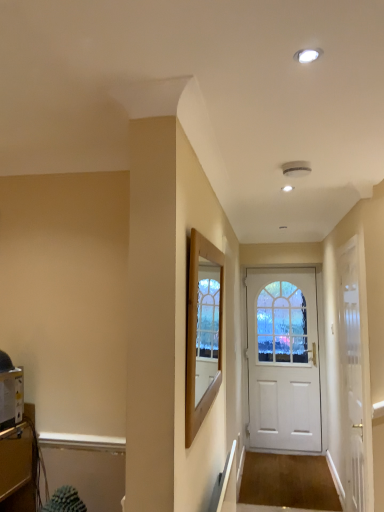
This screenshot has width=384, height=512. What do you see at coordinates (195, 332) in the screenshot? I see `wooden frame at center` at bounding box center [195, 332].

The height and width of the screenshot is (512, 384). I want to click on white glossy door at center, which is the 2th door from back to front, so click(x=352, y=381).

Is metallic silver toaster at lower left looking in the opposite direction of white matte door at center, the second door from the front?

No, metallic silver toaster at lower left is not facing away from white matte door at center, the second door from the front.

Relative to white matte door at center, marked as the first door in a back-to-front arrangement, is metallic silver toaster at lower left in front or behind?

metallic silver toaster at lower left is positioned closer to the viewer than white matte door at center, marked as the first door in a back-to-front arrangement.

From the image's perspective, would you say metallic silver toaster at lower left is shown under white matte door at center, marked as the first door in a back-to-front arrangement?

No.

Is metallic silver toaster at lower left surrounded by wooden frame at center?

No, metallic silver toaster at lower left is located outside of wooden frame at center.

Between wooden frame at center and metallic silver toaster at lower left, which one appears on the right side from the viewer's perspective?

wooden frame at center is more to the right.

Find the location of `window screen lying on the right of metallic silver toaster at lower left`. window screen lying on the right of metallic silver toaster at lower left is located at coordinates pyautogui.click(x=195, y=332).

From a real-world perspective, which object stands above the other?

wooden frame at center is physically above.

Is white glossy door at center, acting as the 1th door starting from the front, closer to the viewer compared to white matte door at center, the second door from the front?

Yes, white glossy door at center, acting as the 1th door starting from the front, is in front of white matte door at center, the second door from the front.

Who is smaller, white glossy door at center, which is the 2th door from back to front, or white matte door at center, marked as the first door in a back-to-front arrangement?

With smaller size is white glossy door at center, which is the 2th door from back to front.

From the picture: Is white glossy door at center, which is the 2th door from back to front, positioned beyond the bounds of white matte door at center, the second door from the front?

Yes, white glossy door at center, which is the 2th door from back to front, is located beyond the bounds of white matte door at center, the second door from the front.

Considering the positions of points (361, 478) and (282, 271), is point (361, 478) closer to camera compared to point (282, 271)?

Yes, it is.

Would you say white glossy door at center, which is the 2th door from back to front, is outside metallic silver toaster at lower left?

Yes, white glossy door at center, which is the 2th door from back to front, is not within metallic silver toaster at lower left.

From a real-world perspective, is white glossy door at center, which is the 2th door from back to front, on top of metallic silver toaster at lower left?

No, from a real-world perspective, white glossy door at center, which is the 2th door from back to front, is not over metallic silver toaster at lower left

Is point (342, 481) closer to viewer compared to point (2, 382)?

That is False.

Considering the relative sizes of white glossy door at center, acting as the 1th door starting from the front, and metallic silver toaster at lower left in the image provided, is white glossy door at center, acting as the 1th door starting from the front, smaller than metallic silver toaster at lower left?

No.

Is white glossy door at center, which is the 2th door from back to front, inside metallic silver toaster at lower left?

No, white glossy door at center, which is the 2th door from back to front, is not surrounded by metallic silver toaster at lower left.

Who is shorter, metallic silver toaster at lower left or white glossy door at center, which is the 2th door from back to front?

metallic silver toaster at lower left is shorter.

Is there a large distance between metallic silver toaster at lower left and white glossy door at center, which is the 2th door from back to front?

Yes, metallic silver toaster at lower left and white glossy door at center, which is the 2th door from back to front, are located far from each other.

Considering the positions of objects metallic silver toaster at lower left and white glossy door at center, acting as the 1th door starting from the front, in the image provided, who is more to the right, metallic silver toaster at lower left or white glossy door at center, acting as the 1th door starting from the front,?

white glossy door at center, acting as the 1th door starting from the front.

In the scene shown: Between wooden frame at center and white glossy door at center, acting as the 1th door starting from the front, which one has more height?

white glossy door at center, acting as the 1th door starting from the front, is taller.

From a real-world perspective, which object rests below the other?

white glossy door at center, which is the 2th door from back to front, from a real-world perspective.

Is white matte door at center, marked as the first door in a back-to-front arrangement, next to metallic silver toaster at lower left?

No, white matte door at center, marked as the first door in a back-to-front arrangement, is not next to metallic silver toaster at lower left.

In the image, there is a white matte door at center, the second door from the front. Identify the location of appliance above it (from the image's perspective). Image resolution: width=384 pixels, height=512 pixels. (11, 398).

Could you measure the distance between white matte door at center, the second door from the front, and metallic silver toaster at lower left?

white matte door at center, the second door from the front, is 3.41 meters away from metallic silver toaster at lower left.

Considering the points (289, 291) and (20, 370), which point is in front, point (289, 291) or point (20, 370)?

Positioned in front is point (20, 370).

Identify the location of appliance located above the white matte door at center, marked as the first door in a back-to-front arrangement (from the image's perspective). (11, 398).

Where is `window screen that is above the metallic silver toaster at lower left (from a real-world perspective)`? This screenshot has height=512, width=384. window screen that is above the metallic silver toaster at lower left (from a real-world perspective) is located at coordinates (195, 332).

Looking at the image, which one is located further to wooden frame at center, white glossy door at center, acting as the 1th door starting from the front, or white matte door at center, the second door from the front?

Among the two, white matte door at center, the second door from the front, is located further to wooden frame at center.

From the picture: Based on their spatial positions, is wooden frame at center or white matte door at center, the second door from the front, further from white glossy door at center, acting as the 1th door starting from the front?

Based on the image, white matte door at center, the second door from the front, appears to be further to white glossy door at center, acting as the 1th door starting from the front.

When comparing their distances from wooden frame at center, does white matte door at center, the second door from the front, or white glossy door at center, acting as the 1th door starting from the front, seem further?

Based on the image, white matte door at center, the second door from the front, appears to be further to wooden frame at center.

Estimate the real-world distances between objects in this image. Which object is further from metallic silver toaster at lower left, white matte door at center, marked as the first door in a back-to-front arrangement, or white glossy door at center, acting as the 1th door starting from the front?

The object further to metallic silver toaster at lower left is white matte door at center, marked as the first door in a back-to-front arrangement.

Estimate the real-world distances between objects in this image. Which object is closer to white glossy door at center, acting as the 1th door starting from the front, metallic silver toaster at lower left or wooden frame at center?

Among the two, wooden frame at center is located nearer to white glossy door at center, acting as the 1th door starting from the front.

When comparing their distances from white matte door at center, the second door from the front, does white glossy door at center, which is the 2th door from back to front, or metallic silver toaster at lower left seem closer?

white glossy door at center, which is the 2th door from back to front, is closer to white matte door at center, the second door from the front.

Estimate the real-world distances between objects in this image. Which object is closer to wooden frame at center, white glossy door at center, acting as the 1th door starting from the front, or metallic silver toaster at lower left?

metallic silver toaster at lower left is positioned closer to the anchor wooden frame at center.

In the scene shown: Based on their spatial positions, is wooden frame at center or white glossy door at center, which is the 2th door from back to front, closer to metallic silver toaster at lower left?

wooden frame at center.

Locate an element on the screen. appliance positioned between wooden frame at center and white matte door at center, marked as the first door in a back-to-front arrangement, from near to far is located at coordinates (11, 398).

The height and width of the screenshot is (512, 384). Identify the location of door between metallic silver toaster at lower left and white matte door at center, marked as the first door in a back-to-front arrangement, in the front-back direction. (352, 381).

Locate an element on the screen. The width and height of the screenshot is (384, 512). window screen located between metallic silver toaster at lower left and white glossy door at center, acting as the 1th door starting from the front, in the left-right direction is located at coordinates (195, 332).

You are a GUI agent. You are given a task and a screenshot of the screen. Output one action in this format:
    pyautogui.click(x=<x>, y=<y>)
    Task: Click on the door positioned between wooden frame at center and white matte door at center, the second door from the front, from near to far
    The height and width of the screenshot is (512, 384).
    Given the screenshot: What is the action you would take?
    352,381